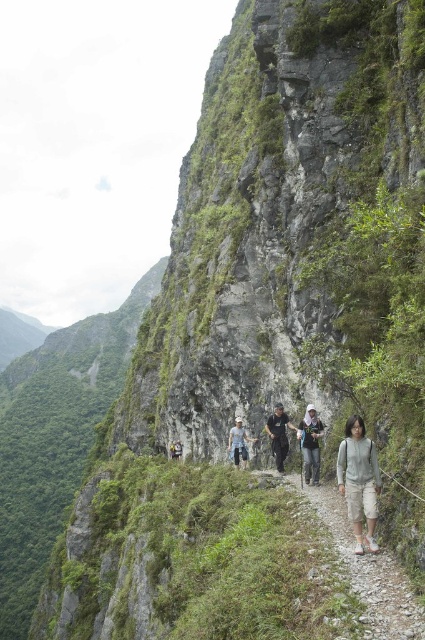
Describe the element at coordinates (368, 572) in the screenshot. The image size is (425, 640). I see `dusty gravel path at center` at that location.

Does dusty gravel path at center appear over light blue denim pants at center?

Yes.

Between point (399, 614) and point (229, 444), which one is positioned in front?

Point (399, 614) is more forward.

At what (x,y) coordinates should I click in order to perform the action: click on dusty gravel path at center. Please return your answer as a coordinate pair (x, y). Image resolution: width=425 pixels, height=640 pixels. Looking at the image, I should click on (368, 572).

Who is positioned more to the right, light gray sweater at center or light blue denim pants at center?

light gray sweater at center is more to the right.

Looking at this image, who is more distant from viewer, (340, 456) or (238, 451)?

Point (238, 451)

Image resolution: width=425 pixels, height=640 pixels. Find the location of `light gray sweater at center`. light gray sweater at center is located at coordinates (359, 481).

Which is behind, point (390, 600) or point (299, 436)?

The point (299, 436) is more distant.

Is dusty gravel path at center taller than light brown fabric backpack at center?

In fact, dusty gravel path at center may be shorter than light brown fabric backpack at center.

Is point (388, 592) farther from viewer compared to point (300, 436)?

That is False.

The width and height of the screenshot is (425, 640). What are the coordinates of `dusty gravel path at center` in the screenshot? It's located at (368, 572).